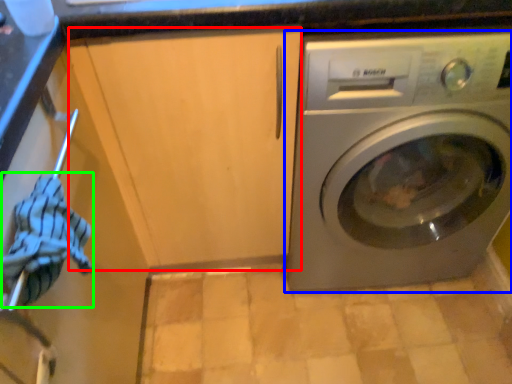
Question: Which is farther away from cabinetry (highlighted by a red box)? washing machine (highlighted by a blue box) or clothing (highlighted by a green box)?

Choices:
 (A) washing machine
 (B) clothing

Answer: (B)